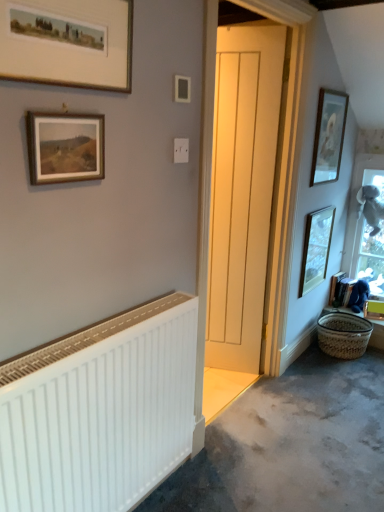
Question: Is gold-framed print at upper left, marked as the first picture frame in a front-to-back arrangement, outside of white matte radiator at lower left?

Choices:
 (A) yes
 (B) no

Answer: (A)

Question: Is gold-framed print at upper left, which appears as the fourth picture frame when viewed from the back, wider than white matte radiator at lower left?

Choices:
 (A) yes
 (B) no

Answer: (B)

Question: From the image's perspective, is gold-framed print at upper left, which appears as the fourth picture frame when viewed from the back, on top of white matte radiator at lower left?

Choices:
 (A) no
 (B) yes

Answer: (B)

Question: Is gold-framed print at upper left, the 2th picture frame when ordered from left to right, to the left of white matte radiator at lower left from the viewer's perspective?

Choices:
 (A) no
 (B) yes

Answer: (B)

Question: Can you confirm if gold-framed print at upper left, marked as the first picture frame in a front-to-back arrangement, is bigger than white matte radiator at lower left?

Choices:
 (A) yes
 (B) no

Answer: (B)

Question: From the image's perspective, is gold-framed print at upper left, marked as the first picture frame in a front-to-back arrangement, beneath white matte radiator at lower left?

Choices:
 (A) yes
 (B) no

Answer: (B)

Question: Is matte wooden picture frame at upper right, acting as the first picture frame starting from the right, shorter than white wooden door at center?

Choices:
 (A) no
 (B) yes

Answer: (B)

Question: Is matte wooden picture frame at upper right, the 4th picture frame in the left-to-right sequence, in front of white wooden door at center?

Choices:
 (A) no
 (B) yes

Answer: (A)

Question: Is matte wooden picture frame at upper right, which ranks as the 2th picture frame in back-to-front order, not close to white wooden door at center?

Choices:
 (A) no
 (B) yes

Answer: (A)

Question: Is matte wooden picture frame at upper right, the 4th picture frame in the left-to-right sequence, taller than white wooden door at center?

Choices:
 (A) no
 (B) yes

Answer: (A)

Question: From the image's perspective, would you say matte wooden picture frame at upper right, acting as the first picture frame starting from the right, is shown under white wooden door at center?

Choices:
 (A) yes
 (B) no

Answer: (B)

Question: Is matte wooden picture frame at upper right, acting as the first picture frame starting from the right, facing towards white wooden door at center?

Choices:
 (A) no
 (B) yes

Answer: (A)

Question: Is white wooden door at center bigger than woven straw basket at lower right?

Choices:
 (A) yes
 (B) no

Answer: (A)